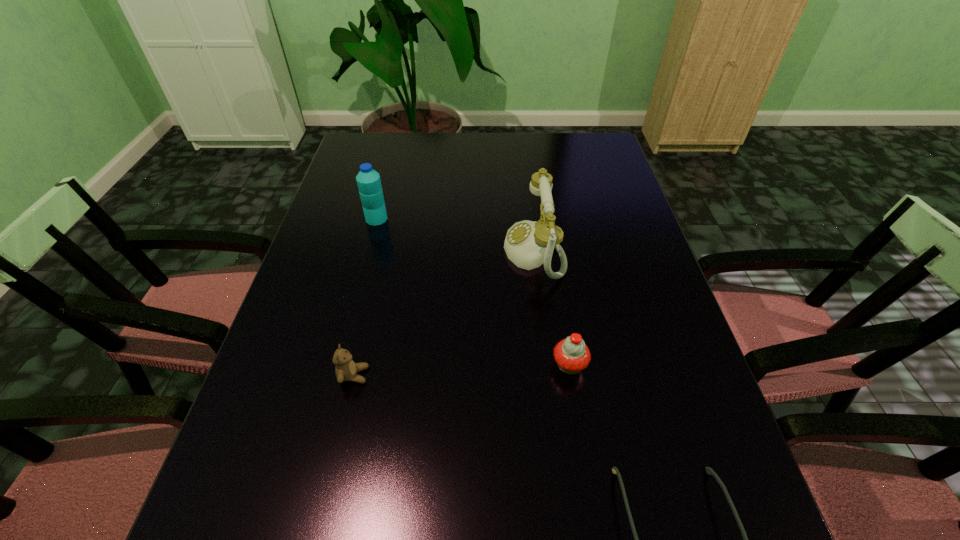
Find the location of a particular element. object that ranks as the third closest to the teddy bear is located at coordinates (368, 180).

Locate an element on the screen. This screenshot has width=960, height=540. object that is the fourth nearest to the nearest object is located at coordinates (368, 180).

This screenshot has width=960, height=540. What are the coordinates of `free location that satisfies the following two spatial constraints: 1. on the dial of the cupcake; 2. on the right side of the telephone` in the screenshot? It's located at (548, 365).

This screenshot has height=540, width=960. I want to click on free space that satisfies the following two spatial constraints: 1. on the front side of the cupcake; 2. on the left side of the water bottle, so click(x=339, y=365).